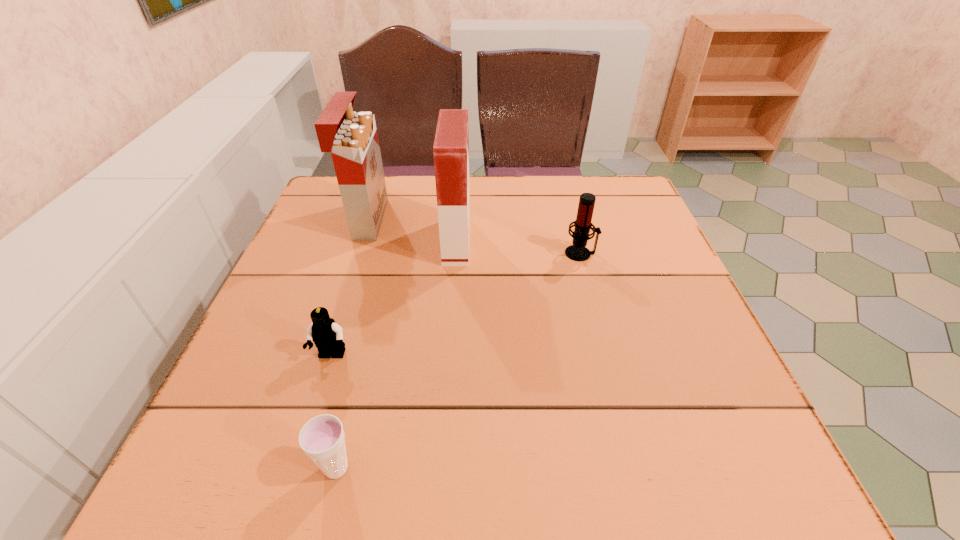
Find the location of a particular element. This screenshot has width=960, height=540. free spot located 0.160m on the right of the nearest object is located at coordinates (463, 468).

Image resolution: width=960 pixels, height=540 pixels. Identify the location of object that is at the near edge. (322, 438).

The image size is (960, 540). Find the location of `cigarette case that is positioned at the left edge`. cigarette case that is positioned at the left edge is located at coordinates (352, 138).

This screenshot has height=540, width=960. Find the location of `Lego located at the left edge`. Lego located at the left edge is located at coordinates (327, 335).

Find the location of a particular element. The width and height of the screenshot is (960, 540). object present at the far left corner is located at coordinates (352, 138).

Where is `free space at the far edge`? free space at the far edge is located at coordinates (419, 180).

At what (x,y) coordinates should I click in order to perform the action: click on vacant space at the near edge of the desktop. Please return your answer as a coordinate pair (x, y). Looking at the image, I should click on (545, 465).

You are a GUI agent. You are given a task and a screenshot of the screen. Output one action in this format:
    pyautogui.click(x=<x>, y=<y>)
    Task: Click on the vacant space at the left edge
    
    Given the screenshot: What is the action you would take?
    pyautogui.click(x=301, y=318)

The image size is (960, 540). In order to click on blank space at the right edge of the desktop in this screenshot , I will do `click(679, 294)`.

The image size is (960, 540). In the image, there is a desktop. What are the coordinates of `vacant space at the far left corner` in the screenshot? It's located at (320, 194).